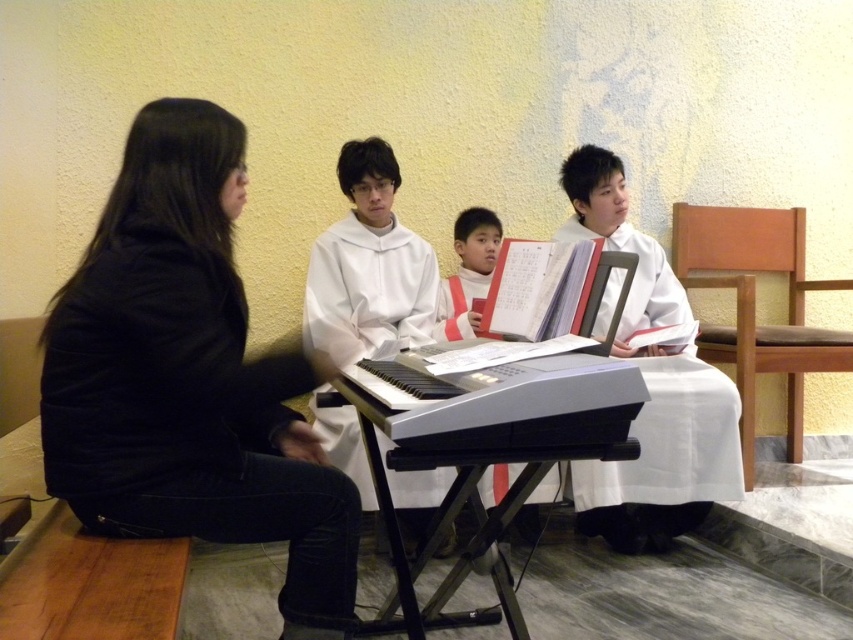
Question: In this image, where is black fabric chair at left located relative to black plastic keyboard at center?

Choices:
 (A) left
 (B) right

Answer: (A)

Question: Which point is farther to the camera?

Choices:
 (A) black matte jacket at left
 (B) black fabric chair at left
 (C) black plastic keyboard at center
 (D) brown leather chair at right

Answer: (D)

Question: Does black plastic keyboard at center have a greater width compared to white paper at center?

Choices:
 (A) yes
 (B) no

Answer: (A)

Question: Is white cloth at center in front of brown leather chair at right?

Choices:
 (A) yes
 (B) no

Answer: (A)

Question: Which point is farther to the camera?

Choices:
 (A) white cloth at center
 (B) white paper at center

Answer: (B)

Question: Which object appears farthest from the camera in this image?

Choices:
 (A) brown leather chair at right
 (B) black plastic keyboard at center
 (C) white paper at center
 (D) black matte jacket at left

Answer: (A)